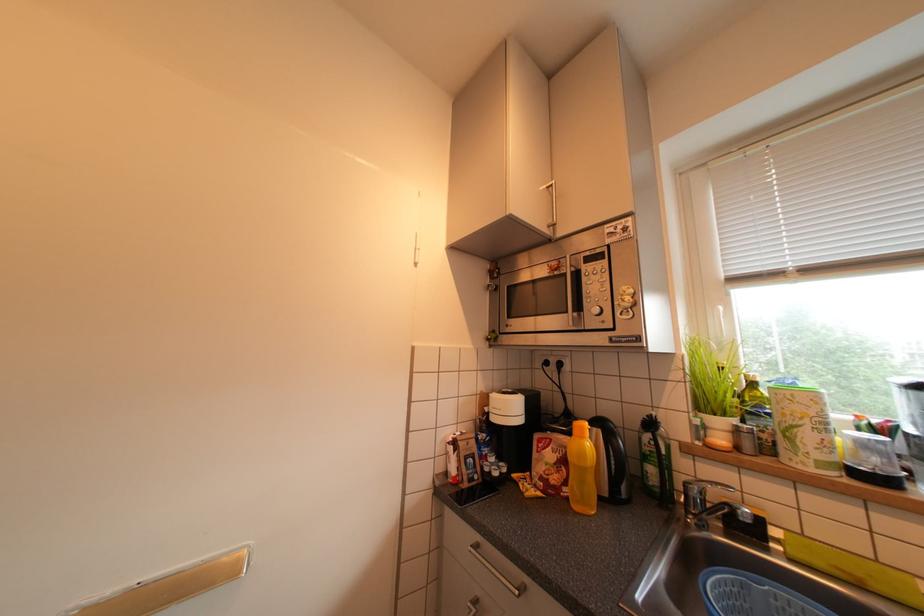
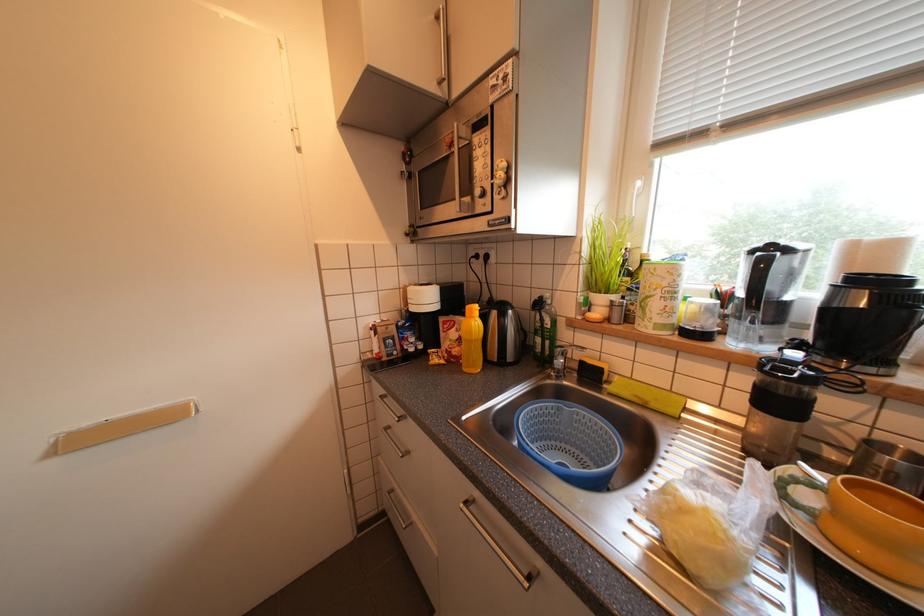
Question: What movement of the cameraman would produce the second image?

Choices:
 (A) Left
 (B) Right
 (C) Forward
 (D) Backward

Answer: (B)